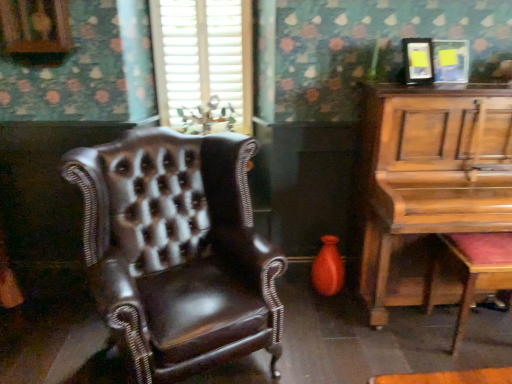
Question: From a real-world perspective, is wooden polished music stool at lower right beneath white textured blinds at upper center?

Choices:
 (A) yes
 (B) no

Answer: (A)

Question: Would you say wooden polished music stool at lower right is outside white textured blinds at upper center?

Choices:
 (A) no
 (B) yes

Answer: (B)

Question: Is wooden polished music stool at lower right oriented away from white textured blinds at upper center?

Choices:
 (A) yes
 (B) no

Answer: (B)

Question: Can you confirm if wooden polished music stool at lower right is shorter than white textured blinds at upper center?

Choices:
 (A) no
 (B) yes

Answer: (B)

Question: Does wooden polished music stool at lower right have a smaller size compared to white textured blinds at upper center?

Choices:
 (A) no
 (B) yes

Answer: (A)

Question: In the image, is shiny brown leather chair at left positioned in front of or behind wooden polished music stool at lower right?

Choices:
 (A) behind
 (B) front

Answer: (B)

Question: From the image's perspective, is shiny brown leather chair at left above or below wooden polished music stool at lower right?

Choices:
 (A) above
 (B) below

Answer: (A)

Question: Considering the positions of point (137, 312) and point (448, 246), is point (137, 312) closer or farther from the camera than point (448, 246)?

Choices:
 (A) closer
 (B) farther

Answer: (A)

Question: In terms of size, does shiny brown leather chair at left appear bigger or smaller than wooden polished music stool at lower right?

Choices:
 (A) big
 (B) small

Answer: (A)

Question: From the image's perspective, is wooden polished music stool at lower right above or below wooden piano at right?

Choices:
 (A) below
 (B) above

Answer: (A)

Question: Considering the positions of point (477, 279) and point (416, 112), is point (477, 279) closer or farther from the camera than point (416, 112)?

Choices:
 (A) closer
 (B) farther

Answer: (A)

Question: In the image, is wooden polished music stool at lower right on the left side or the right side of wooden piano at right?

Choices:
 (A) right
 (B) left

Answer: (A)

Question: Is wooden polished music stool at lower right wider or thinner than wooden piano at right?

Choices:
 (A) thin
 (B) wide

Answer: (A)

Question: From a real-world perspective, is wooden piano at right above or below shiny brown leather chair at left?

Choices:
 (A) below
 (B) above

Answer: (B)

Question: Is wooden piano at right bigger or smaller than shiny brown leather chair at left?

Choices:
 (A) big
 (B) small

Answer: (A)